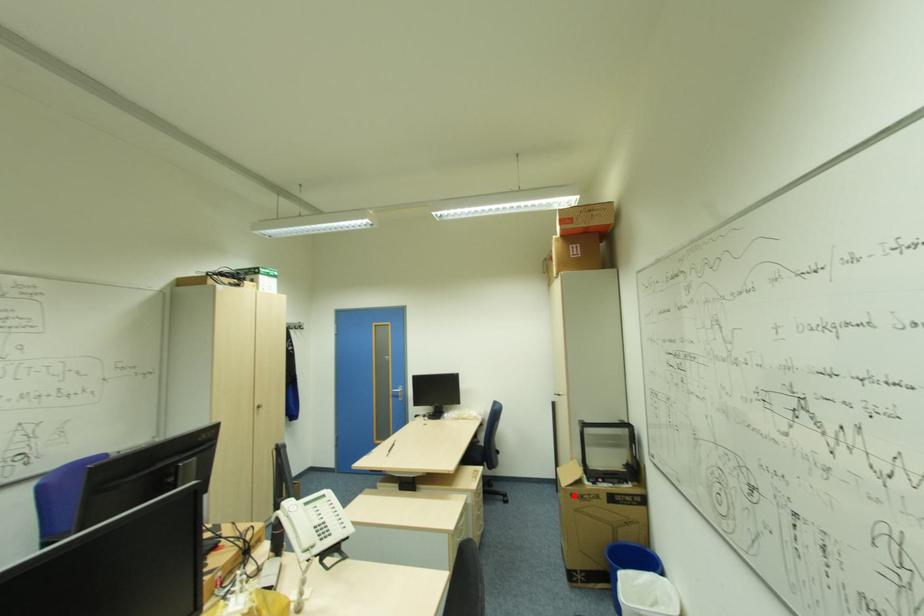
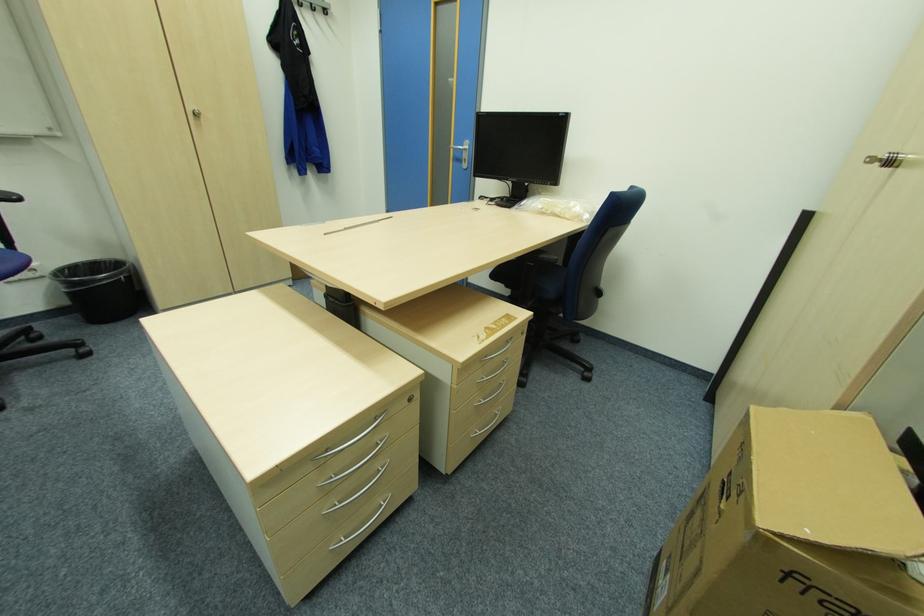
Where in the second image is the point corresponding to the highlighted location from the first image?

(789, 573)